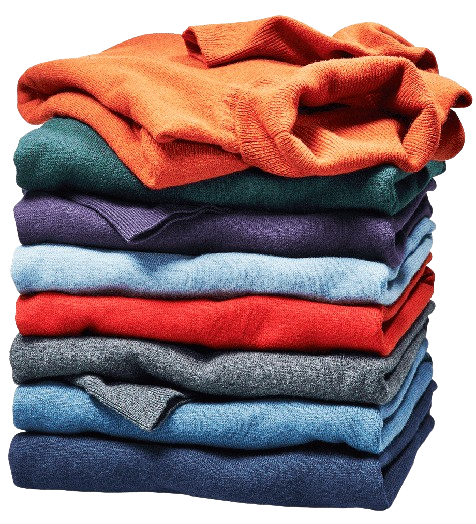
You are a GUI agent. You are given a task and a screenshot of the screen. Output one action in this format:
    pyautogui.click(x=<x>, y=<y>)
    Task: Click on the folded sweater
    The image size is (476, 524).
    Given the screenshot: What is the action you would take?
    pyautogui.click(x=165, y=161), pyautogui.click(x=84, y=148), pyautogui.click(x=65, y=218), pyautogui.click(x=65, y=262), pyautogui.click(x=81, y=313), pyautogui.click(x=72, y=351), pyautogui.click(x=67, y=406), pyautogui.click(x=76, y=458)